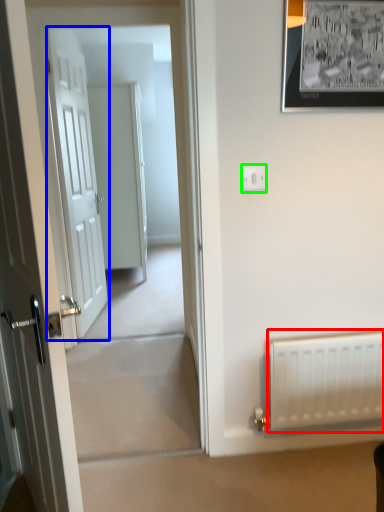
Question: Which is nearer to the radiator (highlighted by a red box)? door (highlighted by a blue box) or electric outlet (highlighted by a green box).

Choices:
 (A) door
 (B) electric outlet

Answer: (B)